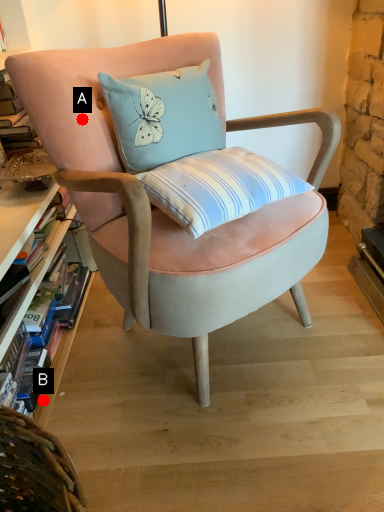
Question: Two points are circled on the image, labeled by A and B beside each circle. Which point is farther to the camera?

Choices:
 (A) A is further
 (B) B is further

Answer: (B)